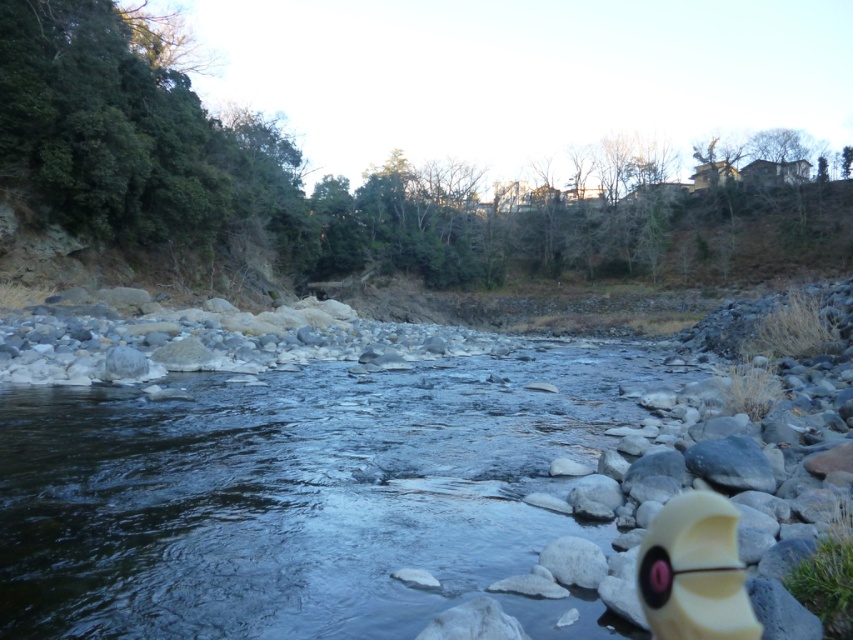
You are standing at the edge of the river and want to cross it to reach the barren trees on the right. The smooth stone stream at center is the only path available. Can you safely cross it if your maximum comfortable crossing distance is 5 meters?

The smooth stone stream at center is 4.86 meters from viewer, which is within your maximum comfortable crossing distance of 5 meters. Therefore, you can safely cross it.

You are a hiker carrying a 15 cm wide backpack. You come across the smooth stone stream at center and the matte yellow toy at lower right. Which path can your backpack fit through without getting stuck?

The smooth stone stream at center is wider than the matte yellow toy at lower right, so the backpack can fit through the smooth stone stream at center.

From the picture: You are a child playing near the river and want to place your matte yellow toy at lower right next to the smooth stone stream at center. Can you fit both objects side by side in the space you have?

The smooth stone stream at center is larger in size than the matte yellow toy at lower right, so there might not be enough space to fit both side by side depending on the available area.